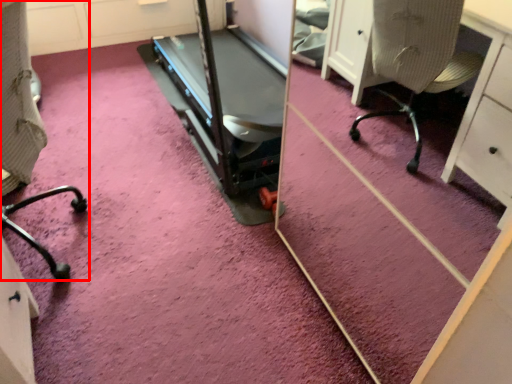
Question: Where is furniture (annotated by the red box) located in relation to treadmill in the image?

Choices:
 (A) left
 (B) right

Answer: (A)